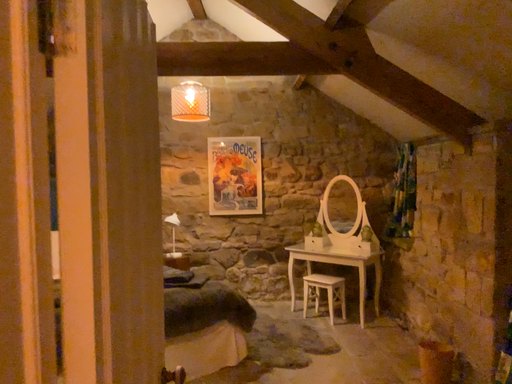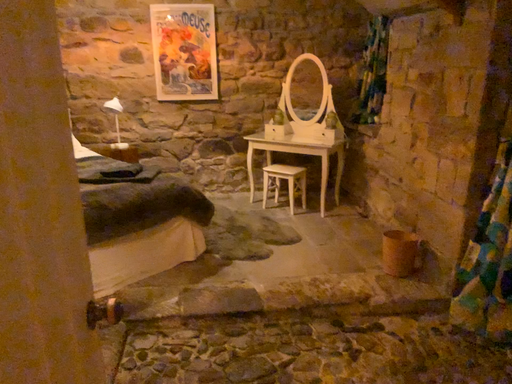
Question: How did the camera likely rotate when shooting the video?

Choices:
 (A) rotated downward
 (B) rotated upward

Answer: (A)